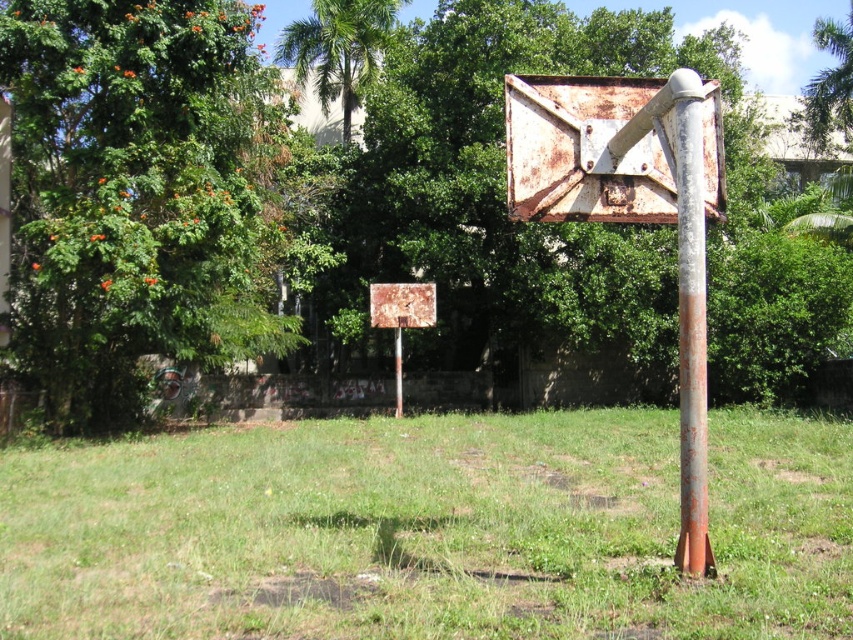
You are standing in the grassy area looking at the two basketball hoops. There are two points marked in the image. Which point, point (577, 152) or point (296, 81), is closer to you?

Point (577, 152) is closer to the camera than point (296, 81).

You are a painter hired to paint the rusty metal pole at right and the rusty metal basketball hoop at center. You have a ladder that can reach up to 3 meters. Can you safely paint both objects without needing a taller ladder?

The rusty metal pole at right is much taller than the rusty metal basketball hoop at center. Since the ladder can only reach up to 3 meters, you might not be able to safely paint the taller rusty metal pole at right if it exceeds the ladder height. However, the shorter rusty metal basketball hoop at center may be within reach.

You are standing at the base of the green leafy tree at center and want to place a 10 meter long fence between it and the rusty metal sign at upper right. Will the fence reach the sign?

The distance between the green leafy tree at center and the rusty metal sign at upper right is 10.61 meters. Since the fence is only 10 meters long, it will not be long enough to reach the sign.